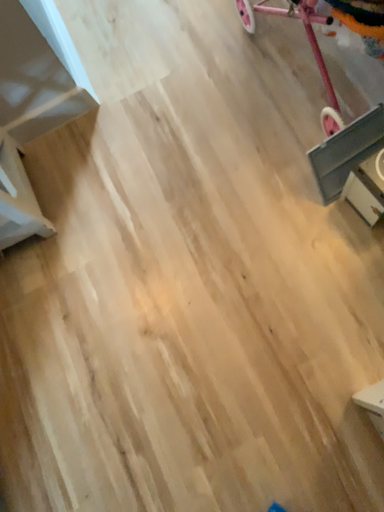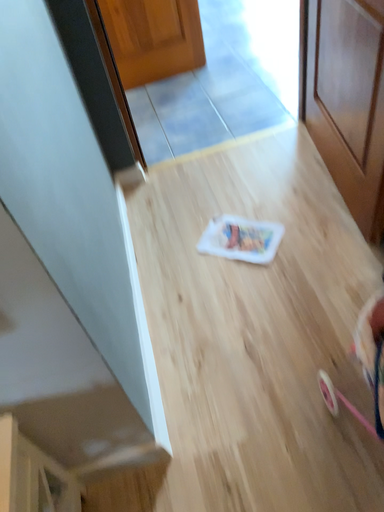
Question: Which way did the camera rotate in the video?

Choices:
 (A) rotated downward
 (B) rotated upward

Answer: (B)